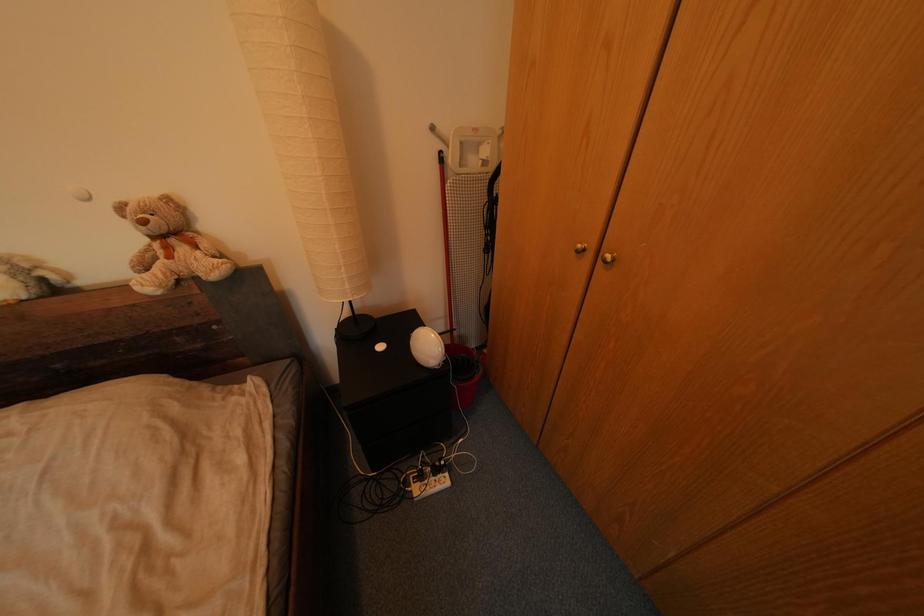
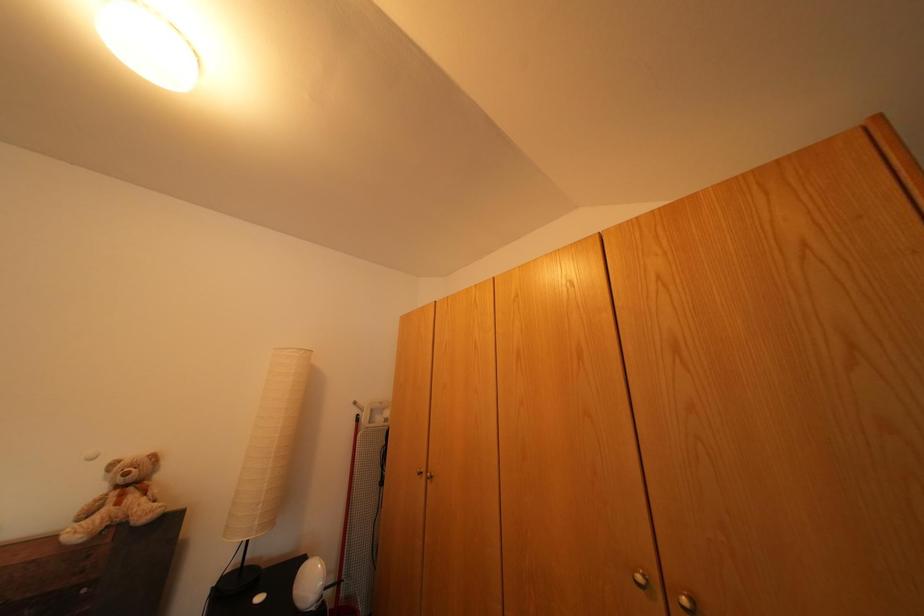
Based on the photo, how did the camera likely rotate?

The rotation direction of the camera is right-up.